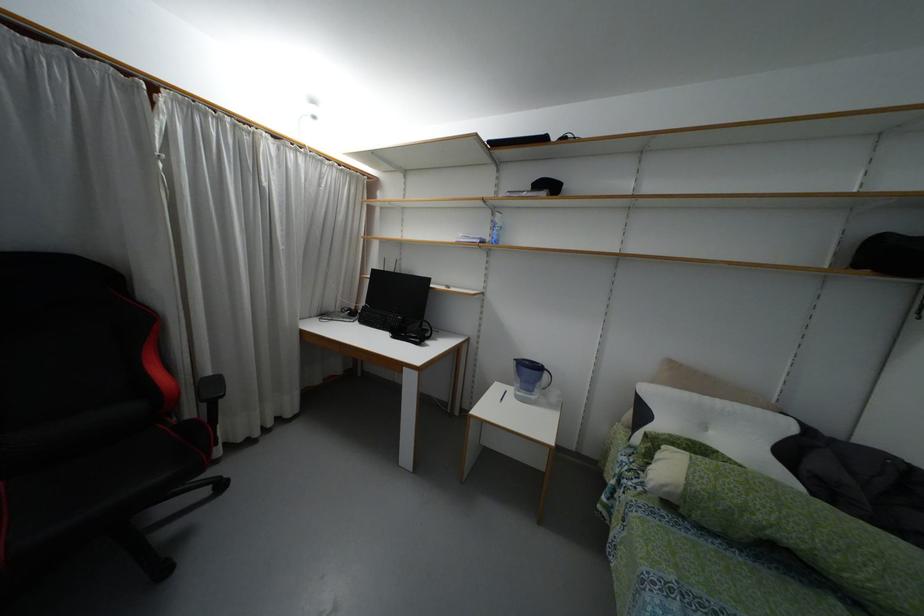
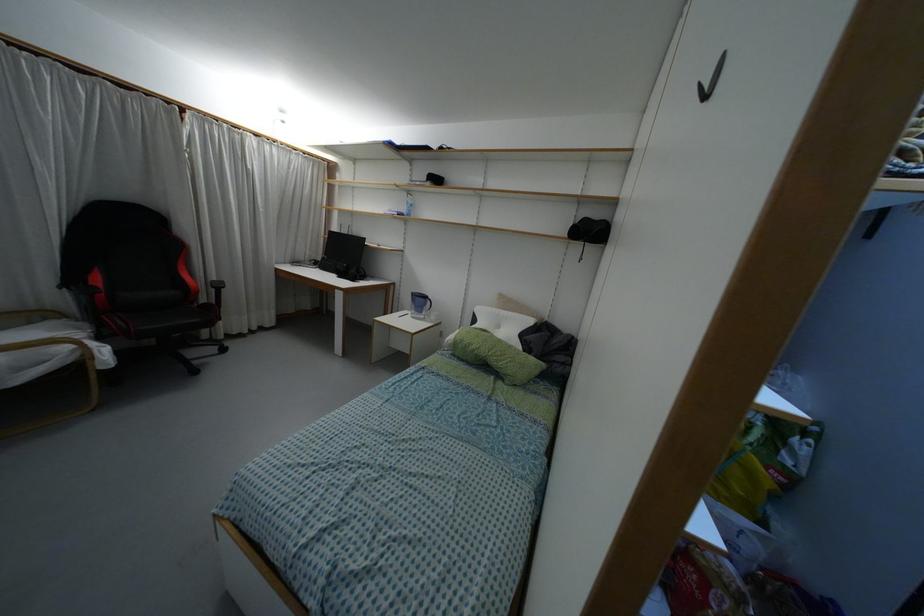
Find the pixel in the second image that matches point 493,209 in the first image.

(407, 192)